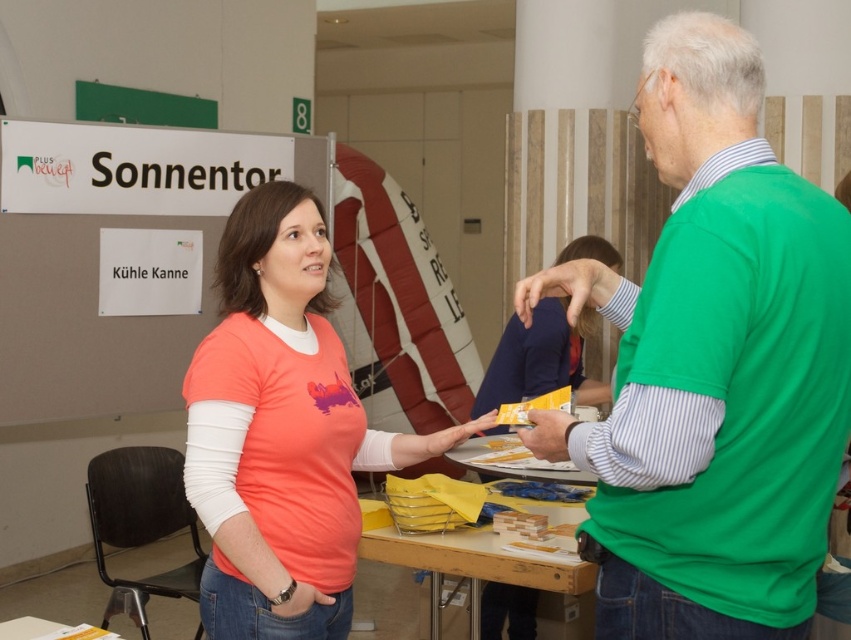
Who is higher up, green matte shirt at center or wooden table at center?

green matte shirt at center is above.

Between point (766, 502) and point (427, 625), which one is positioned in front?

Point (766, 502) is in front.

The width and height of the screenshot is (851, 640). Describe the element at coordinates (720, 368) in the screenshot. I see `green matte shirt at center` at that location.

You are a GUI agent. You are given a task and a screenshot of the screen. Output one action in this format:
    pyautogui.click(x=<x>, y=<y>)
    Task: Click on the green matte shirt at center
    The image size is (851, 640).
    Given the screenshot: What is the action you would take?
    pyautogui.click(x=720, y=368)

Based on the photo, can you confirm if green fabric hand at center is positioned to the left of green matte hand at center?

Incorrect, green fabric hand at center is not on the left side of green matte hand at center.

Measure the distance from green fabric hand at center to green matte hand at center.

The distance of green fabric hand at center from green matte hand at center is 9.38 inches.

The height and width of the screenshot is (640, 851). Find the location of `green fabric hand at center`. green fabric hand at center is located at coordinates (567, 288).

Identify the location of green fabric hand at center. 567,288.

Does matte green shirt at center have a larger size compared to matte yellow plastic spoon at center?

Yes, matte green shirt at center is bigger than matte yellow plastic spoon at center.

At what (x,y) coordinates should I click in order to perform the action: click on matte green shirt at center. Please return your answer as a coordinate pair (x, y). This screenshot has width=851, height=640. Looking at the image, I should click on (540, 358).

This screenshot has height=640, width=851. What do you see at coordinates (540, 358) in the screenshot? I see `matte green shirt at center` at bounding box center [540, 358].

Locate an element on the screen. The width and height of the screenshot is (851, 640). matte green shirt at center is located at coordinates (540, 358).